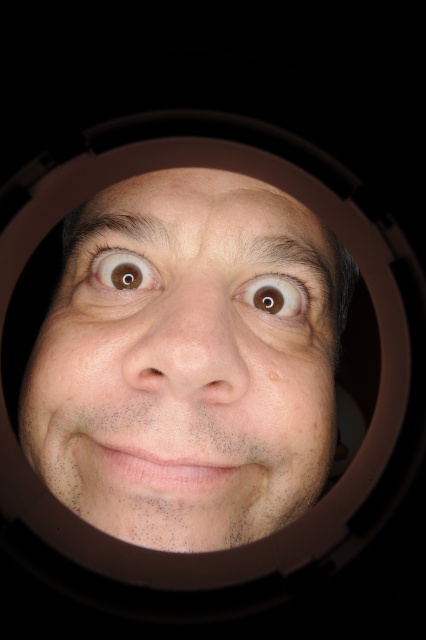
Question: Where is brown matte eye at center located in relation to brown matte eye at upper left in the image?

Choices:
 (A) below
 (B) above

Answer: (A)

Question: Which of the following is the farthest from the observer?

Choices:
 (A) brown matte eye at upper left
 (B) smooth skin face at center

Answer: (A)

Question: Does smooth skin face at center lie in front of brown matte eye at upper left?

Choices:
 (A) yes
 (B) no

Answer: (A)

Question: Among these points, which one is farthest from the camera?

Choices:
 (A) (143, 230)
 (B) (279, 285)

Answer: (B)

Question: Which object is the closest to the brown matte eye at center?

Choices:
 (A) brown matte eye at upper left
 (B) smooth skin face at center

Answer: (A)

Question: Is smooth skin face at center bigger than brown matte eye at upper left?

Choices:
 (A) yes
 (B) no

Answer: (A)